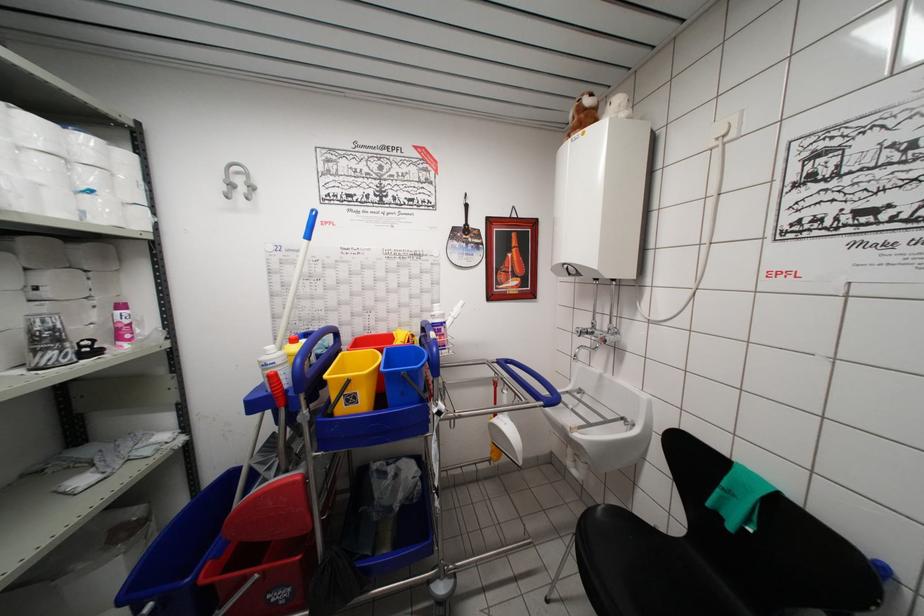
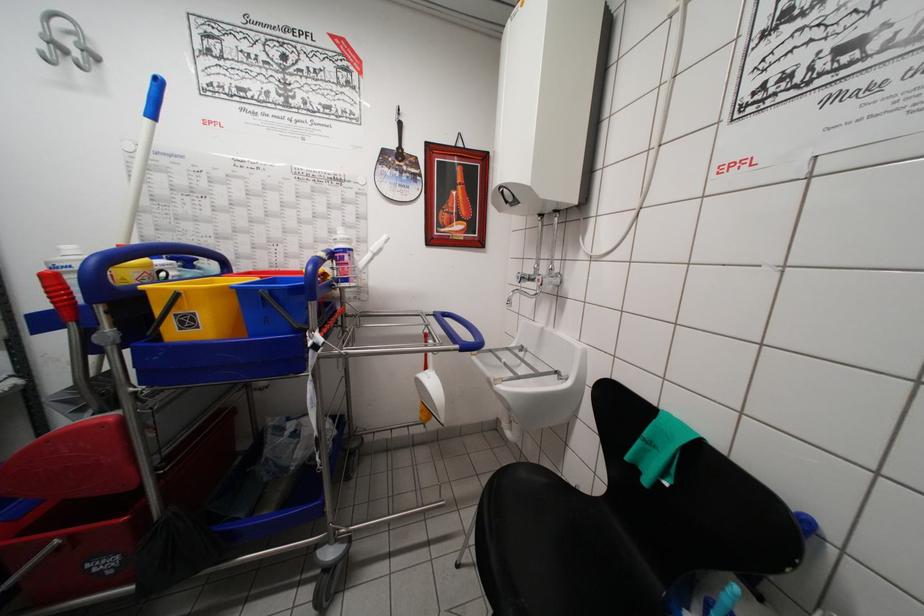
The point at [456,318] is marked in the first image. Where is the corresponding point in the second image?

(377, 253)